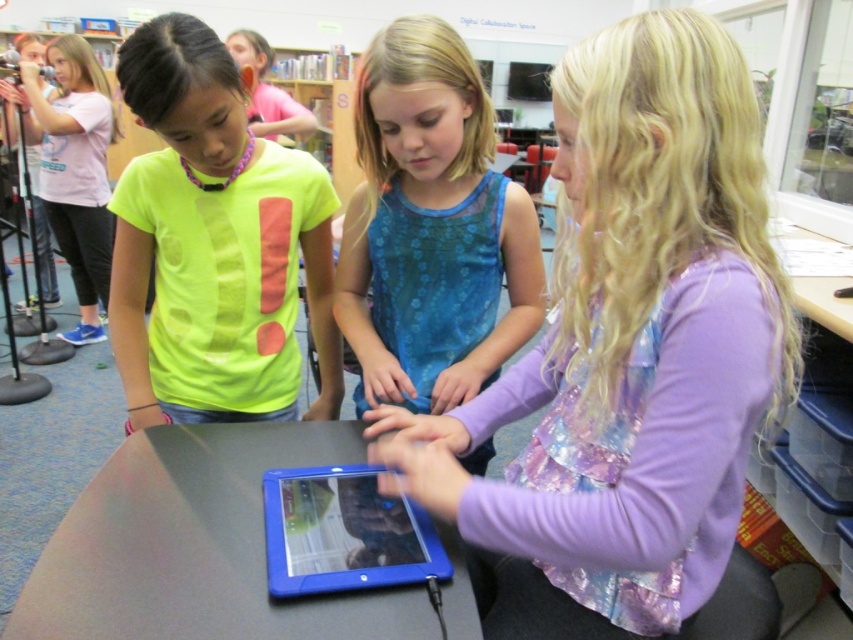
Which is more to the right, smooth gray table at center or pink t-shirt at upper left?

Positioned to the right is smooth gray table at center.

Who is shorter, smooth gray table at center or pink t-shirt at upper left?

smooth gray table at center is shorter.

Describe the element at coordinates (196, 547) in the screenshot. I see `smooth gray table at center` at that location.

At what (x,y) coordinates should I click in order to perform the action: click on smooth gray table at center. Please return your answer as a coordinate pair (x, y). The image size is (853, 640). Looking at the image, I should click on (196, 547).

Between point (573, 406) and point (380, 218), which one is positioned in front?

Point (573, 406)

Is shiny purple shirt at center smaller than blue sheer dress at center?

No, shiny purple shirt at center is not smaller than blue sheer dress at center.

Measure the distance between point (543, 611) and camera.

Point (543, 611) and camera are 98.02 centimeters apart.

Locate an element on the screen. The width and height of the screenshot is (853, 640). shiny purple shirt at center is located at coordinates (630, 358).

Between smooth gray table at center and matte pink shirt at upper center, which one is positioned higher?

matte pink shirt at upper center is above.

The image size is (853, 640). I want to click on smooth gray table at center, so click(x=196, y=547).

Locate an element on the screen. The image size is (853, 640). smooth gray table at center is located at coordinates (196, 547).